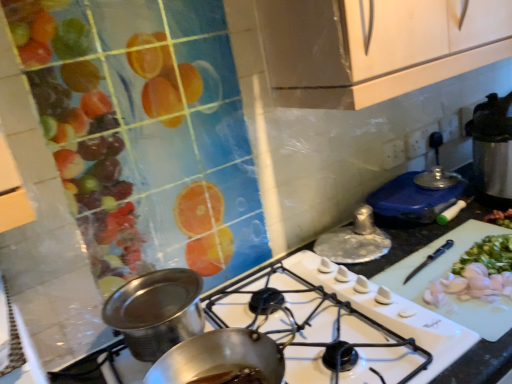
Question: Is the depth of white plastic cutting board at center-right less than that of shiny metallic pot at center, marked as the first kitchen appliance in a left-to-right arrangement?

Choices:
 (A) no
 (B) yes

Answer: (A)

Question: From a real-world perspective, does white plastic cutting board at center-right stand above shiny metallic pot at center, arranged as the first kitchen appliance when ordered from the bottom?

Choices:
 (A) no
 (B) yes

Answer: (A)

Question: From the image's perspective, is white plastic cutting board at center-right above shiny metallic pot at center, the third kitchen appliance viewed from the back?

Choices:
 (A) yes
 (B) no

Answer: (A)

Question: Is white plastic cutting board at center-right smaller than shiny metallic pot at center, marked as the first kitchen appliance in a left-to-right arrangement?

Choices:
 (A) yes
 (B) no

Answer: (B)

Question: Is white plastic cutting board at center-right turned away from shiny metallic pot at center, marked as the third kitchen appliance in a top-to-bottom arrangement?

Choices:
 (A) no
 (B) yes

Answer: (A)

Question: From a real-world perspective, is white glossy gas stove at center positioned above or below white plastic cutting board at center-right?

Choices:
 (A) above
 (B) below

Answer: (A)

Question: From the image's perspective, is white glossy gas stove at center above or below white plastic cutting board at center-right?

Choices:
 (A) above
 (B) below

Answer: (B)

Question: Do you think white glossy gas stove at center is within white plastic cutting board at center-right, or outside of it?

Choices:
 (A) outside
 (B) inside

Answer: (A)

Question: Is white glossy gas stove at center taller or shorter than white plastic cutting board at center-right?

Choices:
 (A) short
 (B) tall

Answer: (A)

Question: In terms of size, does shiny metallic pot at center, the third kitchen appliance viewed from the back, appear bigger or smaller than silver metallic lid at center, the second kitchen appliance when ordered from bottom to top?

Choices:
 (A) big
 (B) small

Answer: (A)

Question: Is shiny metallic pot at center, marked as the third kitchen appliance in a top-to-bottom arrangement, to the left or to the right of silver metallic lid at center, the second kitchen appliance when ordered from top to bottom, in the image?

Choices:
 (A) right
 (B) left

Answer: (B)

Question: Is shiny metallic pot at center, the third kitchen appliance viewed from the back, inside or outside of silver metallic lid at center, which appears as the 2th kitchen appliance when viewed from the left?

Choices:
 (A) outside
 (B) inside

Answer: (A)

Question: Considering the positions of point (102, 319) and point (371, 228), is point (102, 319) closer or farther from the camera than point (371, 228)?

Choices:
 (A) farther
 (B) closer

Answer: (B)

Question: In terms of width, does shiny metallic lid at upper right, which appears as the first kitchen appliance when viewed from the top, look wider or thinner when compared to white plastic cutting board at center-right?

Choices:
 (A) wide
 (B) thin

Answer: (B)

Question: In terms of height, does shiny metallic lid at upper right, which appears as the 3th kitchen appliance when viewed from the left, look taller or shorter compared to white plastic cutting board at center-right?

Choices:
 (A) tall
 (B) short

Answer: (B)